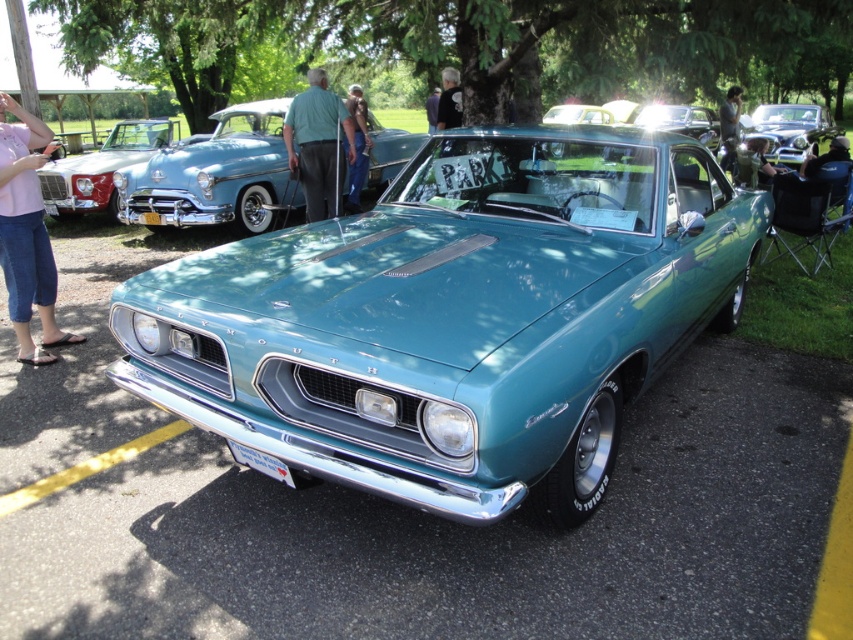
Question: Does matte white car at left appear under matte black jacket at center?

Choices:
 (A) yes
 (B) no

Answer: (A)

Question: Does matte blue jeans at center lie in front of dark gray shirt at center?

Choices:
 (A) yes
 (B) no

Answer: (A)

Question: Among these points, which one is nearest to the camera?

Choices:
 (A) click(734, 86)
 (B) click(315, 202)
 (C) click(451, 99)
 (D) click(430, 116)

Answer: (B)

Question: Estimate the real-world distances between objects in this image. Which object is closer to the teal glossy car at center?

Choices:
 (A) matte black jacket at center
 (B) teal glossy sedan at center

Answer: (A)

Question: Can you confirm if teal glossy sedan at center is positioned to the left of matte white car at left?

Choices:
 (A) no
 (B) yes

Answer: (A)

Question: Among these objects, which one is farthest from the camera?

Choices:
 (A) dark gray shirt at center
 (B) teal glossy sedan at center

Answer: (A)